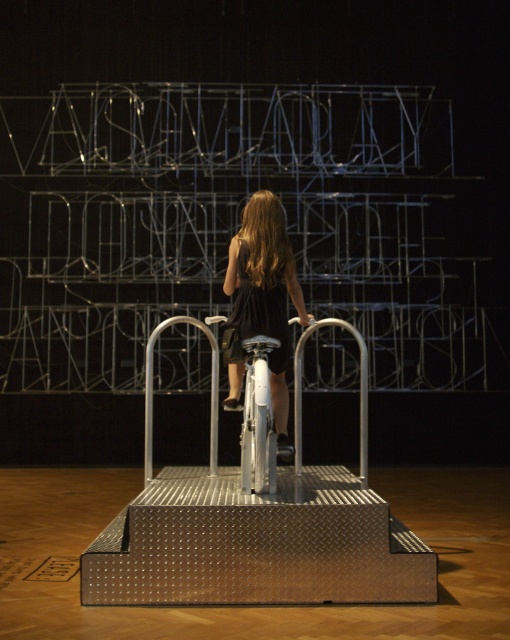
Question: Can you confirm if silver metallic rail at center is smaller than black satin dress at center?

Choices:
 (A) yes
 (B) no

Answer: (B)

Question: Which point is farther from the camera taking this photo?

Choices:
 (A) (258, 273)
 (B) (208, 333)
 (C) (272, 330)

Answer: (C)

Question: Which object appears farthest from the camera in this image?

Choices:
 (A) black matte dress at center
 (B) silver metallic rail at center
 (C) black satin dress at center

Answer: (C)

Question: Among these points, which one is farthest from the camera?

Choices:
 (A) (243, 333)
 (B) (146, 353)
 (C) (266, 326)

Answer: (A)

Question: Is silver metallic rail at center closer to camera compared to black satin dress at center?

Choices:
 (A) no
 (B) yes

Answer: (B)

Question: Does black matte dress at center appear over silver metallic rail at center?

Choices:
 (A) no
 (B) yes

Answer: (B)